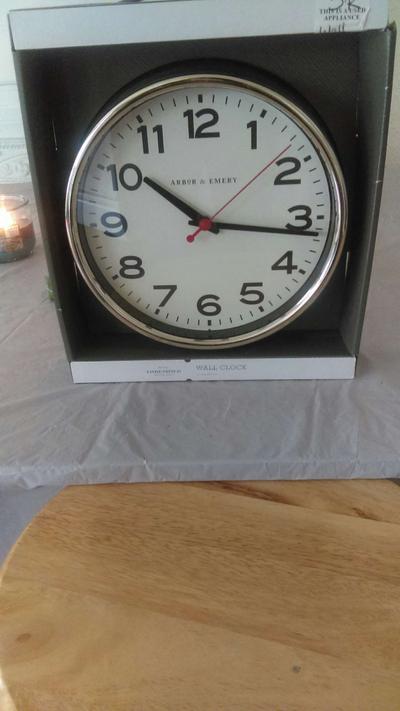
Where is `cardboard box`? cardboard box is located at coordinates pos(203,11).